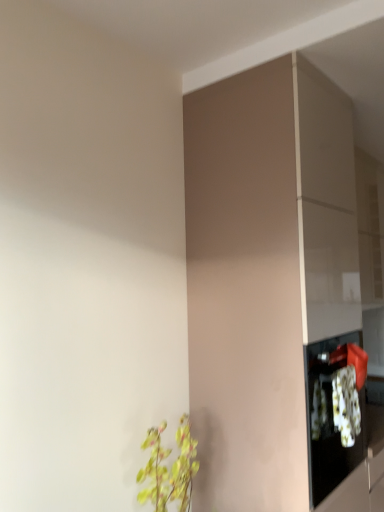
This screenshot has width=384, height=512. What do you see at coordinates (267, 278) in the screenshot?
I see `matte brown cabinet at center` at bounding box center [267, 278].

Locate an element on the screen. This screenshot has height=512, width=384. matte brown cabinet at center is located at coordinates (267, 278).

What is the approximate height of green leafy plant at lower left?

green leafy plant at lower left is 18.04 inches tall.

The width and height of the screenshot is (384, 512). Describe the element at coordinates (167, 469) in the screenshot. I see `green leafy plant at lower left` at that location.

This screenshot has width=384, height=512. Identify the location of green leafy plant at lower left. (167, 469).

Identify the location of matte brown cabinet at center. The height and width of the screenshot is (512, 384). (267, 278).

Considering the positions of objects matte brown cabinet at center and green leafy plant at lower left in the image provided, who is more to the right, matte brown cabinet at center or green leafy plant at lower left?

matte brown cabinet at center.

Is matte brown cabinet at center further to the viewer compared to green leafy plant at lower left?

Yes, matte brown cabinet at center is further from the viewer.

Which point is more forward, [282,464] or [171,489]?

Point [171,489]

From the image's perspective, is matte brown cabinet at center on top of green leafy plant at lower left?

Yes, from the image's perspective, matte brown cabinet at center is over green leafy plant at lower left.

From a real-world perspective, is matte brown cabinet at center below green leafy plant at lower left?

Actually, matte brown cabinet at center is physically above green leafy plant at lower left in the real world.

Considering the sizes of matte brown cabinet at center and green leafy plant at lower left in the image, is matte brown cabinet at center wider or thinner than green leafy plant at lower left?

Considering their sizes, matte brown cabinet at center looks broader than green leafy plant at lower left.

Considering the sizes of objects matte brown cabinet at center and green leafy plant at lower left in the image provided, who is shorter, matte brown cabinet at center or green leafy plant at lower left?

Standing shorter between the two is green leafy plant at lower left.

Between matte brown cabinet at center and green leafy plant at lower left, which one has smaller size?

green leafy plant at lower left.

Based on the photo, is matte brown cabinet at center inside or outside of green leafy plant at lower left?

matte brown cabinet at center is spatially situated outside green leafy plant at lower left.

Is matte brown cabinet at center touching green leafy plant at lower left?

No, matte brown cabinet at center is not with green leafy plant at lower left.

Is matte brown cabinet at center aimed at green leafy plant at lower left?

No, matte brown cabinet at center is not facing towards green leafy plant at lower left.

How many degrees apart are the facing directions of matte brown cabinet at center and green leafy plant at lower left?

The facing directions of matte brown cabinet at center and green leafy plant at lower left are 0.475 degrees apart.

Measure the distance between matte brown cabinet at center and green leafy plant at lower left.

25.43 inches.

Find the location of a particular element. This screenshot has width=384, height=512. cabinetry above the green leafy plant at lower left (from a real-world perspective) is located at coordinates (267, 278).

In the image, is green leafy plant at lower left on the left side or the right side of matte brown cabinet at center?

Based on their positions, green leafy plant at lower left is located to the left of matte brown cabinet at center.

Is the depth of green leafy plant at lower left less than that of matte brown cabinet at center?

Yes, green leafy plant at lower left is closer to the camera.

Does point (162, 453) lie behind point (198, 95)?

No, it is not.

From the image's perspective, is green leafy plant at lower left located above or below matte brown cabinet at center?

Clearly, from the image's perspective, green leafy plant at lower left is below matte brown cabinet at center.

From a real-world perspective, is green leafy plant at lower left located beneath matte brown cabinet at center?

Yes, from a real-world perspective, green leafy plant at lower left is beneath matte brown cabinet at center.

From the picture: Does green leafy plant at lower left have a greater width compared to matte brown cabinet at center?

Incorrect, the width of green leafy plant at lower left does not surpass that of matte brown cabinet at center.

Considering the sizes of green leafy plant at lower left and matte brown cabinet at center in the image, is green leafy plant at lower left taller or shorter than matte brown cabinet at center?

green leafy plant at lower left is shorter than matte brown cabinet at center.

Who is smaller, green leafy plant at lower left or matte brown cabinet at center?

With smaller size is green leafy plant at lower left.

Is green leafy plant at lower left located outside matte brown cabinet at center?

Yes, green leafy plant at lower left is not within matte brown cabinet at center.

Consider the image. Would you consider green leafy plant at lower left to be distant from matte brown cabinet at center?

No, green leafy plant at lower left is not far from matte brown cabinet at center.

Is green leafy plant at lower left looking in the opposite direction of matte brown cabinet at center?

No, green leafy plant at lower left's orientation is not away from matte brown cabinet at center.

This screenshot has height=512, width=384. Find the location of `houseplant lying below the matte brown cabinet at center (from the image's perspective)`. houseplant lying below the matte brown cabinet at center (from the image's perspective) is located at coordinates (167, 469).

There is a green leafy plant at lower left. In order to click on cabinetry above it (from a real-world perspective) in this screenshot , I will do `click(267, 278)`.

This screenshot has width=384, height=512. I want to click on houseplant located underneath the matte brown cabinet at center (from a real-world perspective), so click(x=167, y=469).